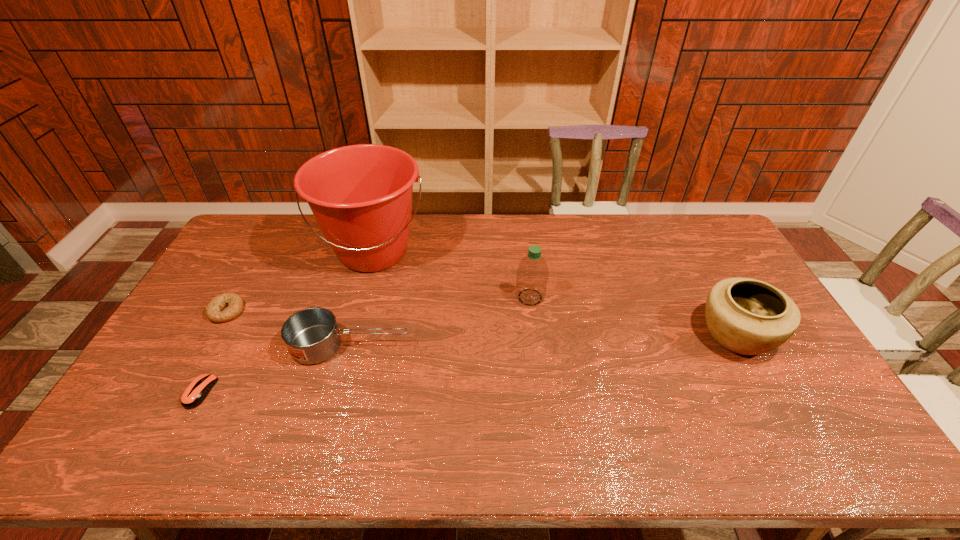
Locate an element on the screen. vacant space situated 0.210m on the back of the fifth shortest object is located at coordinates (524, 247).

Identify the location of vacant space situated on the back of the rightmost object. (692, 254).

Locate an element on the screen. Image resolution: width=960 pixels, height=540 pixels. vacant space located 0.230m with the handle extending from one side of the fourth tallest object is located at coordinates tap(488, 346).

Identify the location of free region located on the front of the bagel. click(x=207, y=346).

Identify the location of blank space located on the back of the computer mouse. The width and height of the screenshot is (960, 540). (219, 357).

Locate an element on the screen. object positioned at the far edge is located at coordinates (361, 195).

You are a GUI agent. You are given a task and a screenshot of the screen. Output one action in this format:
    pyautogui.click(x=<x>, y=<y>)
    Task: Click on the bagel located at the left edge
    
    Given the screenshot: What is the action you would take?
    pyautogui.click(x=213, y=312)

The width and height of the screenshot is (960, 540). Identify the location of computer mouse present at the left edge. (198, 389).

Find the location of a particular element. object that is at the right edge is located at coordinates (746, 316).

In the image, there is a desktop. Where is `free region at the far edge`? The image size is (960, 540). free region at the far edge is located at coordinates (593, 242).